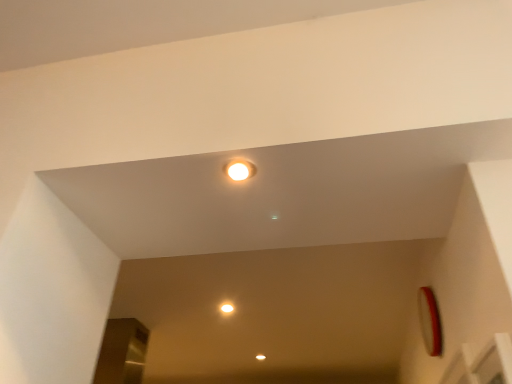
I want to click on white glossy light at center, so click(239, 169).

The width and height of the screenshot is (512, 384). What do you see at coordinates (239, 169) in the screenshot?
I see `white glossy light at center` at bounding box center [239, 169].

What is the approximate height of matte white light at center?

It is 5.19 centimeters.

At what (x,y) coordinates should I click in order to perform the action: click on matte white light at center. Please return your answer as a coordinate pair (x, y). Looking at the image, I should click on (227, 308).

What is the approximate width of matte white light at center?

matte white light at center is 3.17 inches wide.

Describe the element at coordinates (227, 308) in the screenshot. This screenshot has width=512, height=384. I see `matte white light at center` at that location.

In order to click on white glossy light at center in this screenshot , I will do `click(239, 169)`.

From the picture: Which is more to the left, white glossy light at center or matte white light at center?

Positioned to the left is matte white light at center.

Which object is more forward, white glossy light at center or matte white light at center?

white glossy light at center is more forward.

Is point (250, 175) positioned in front of point (220, 307)?

That is True.

From the image's perspective, between white glossy light at center and matte white light at center, who is located below?

From the image's view, matte white light at center is below.

From a real-world perspective, which is physically below, white glossy light at center or matte white light at center?

white glossy light at center is physically lower.

Is white glossy light at center wider than matte white light at center?

Yes.

Which of these two, white glossy light at center or matte white light at center, stands taller?

Standing taller between the two is matte white light at center.

Who is bigger, white glossy light at center or matte white light at center?

matte white light at center is bigger.

Is white glossy light at center inside the boundaries of matte white light at center, or outside?

white glossy light at center cannot be found inside matte white light at center.

Would you say white glossy light at center is a long distance from matte white light at center?

white glossy light at center is far away from matte white light at center.

Is white glossy light at center aimed at matte white light at center?

No, white glossy light at center does not turn towards matte white light at center.

How many degrees apart are the facing directions of white glossy light at center and matte white light at center?

white glossy light at center and matte white light at center are facing 180 degrees away from each other.

At what (x,y) coordinates should I click in order to perform the action: click on dot above the white glossy light at center (from a real-world perspective). Please return your answer as a coordinate pair (x, y). This screenshot has height=384, width=512. Looking at the image, I should click on (227, 308).

Would you say matte white light at center is to the left or to the right of white glossy light at center in the picture?

matte white light at center is to the left of white glossy light at center.

Considering the positions of objects matte white light at center and white glossy light at center in the image provided, who is in front, matte white light at center or white glossy light at center?

white glossy light at center is closer to the camera.

Which point is more forward, [222,311] or [243,165]?

The point [243,165] is in front.

From the image's perspective, is matte white light at center positioned above or below white glossy light at center?

Clearly, from the image's perspective, matte white light at center is below white glossy light at center.

From a real-world perspective, is matte white light at center physically below white glossy light at center?

No, from a real-world perspective, matte white light at center is not beneath white glossy light at center.

In terms of width, does matte white light at center look wider or thinner when compared to white glossy light at center?

Considering their sizes, matte white light at center looks slimmer than white glossy light at center.

Considering the sizes of objects matte white light at center and white glossy light at center in the image provided, who is taller, matte white light at center or white glossy light at center?

matte white light at center is taller.

Who is smaller, matte white light at center or white glossy light at center?

With smaller size is white glossy light at center.

Choose the correct answer: Is matte white light at center inside white glossy light at center or outside it?

matte white light at center exists outside the volume of white glossy light at center.

Would you say matte white light at center is a long distance from white glossy light at center?

That's right, there is a large distance between matte white light at center and white glossy light at center.

Is matte white light at center facing away from white glossy light at center?

Yes, matte white light at center is positioned with its back facing white glossy light at center.

How many degrees apart are the facing directions of matte white light at center and white glossy light at center?

matte white light at center and white glossy light at center are facing 180 degrees away from each other.

Identify the location of dot that appears on the left of white glossy light at center. The image size is (512, 384). (227, 308).

The width and height of the screenshot is (512, 384). I want to click on light on the right of matte white light at center, so click(x=239, y=169).

What are the coordinates of `dot that appears on the left of white glossy light at center` in the screenshot? It's located at (227, 308).